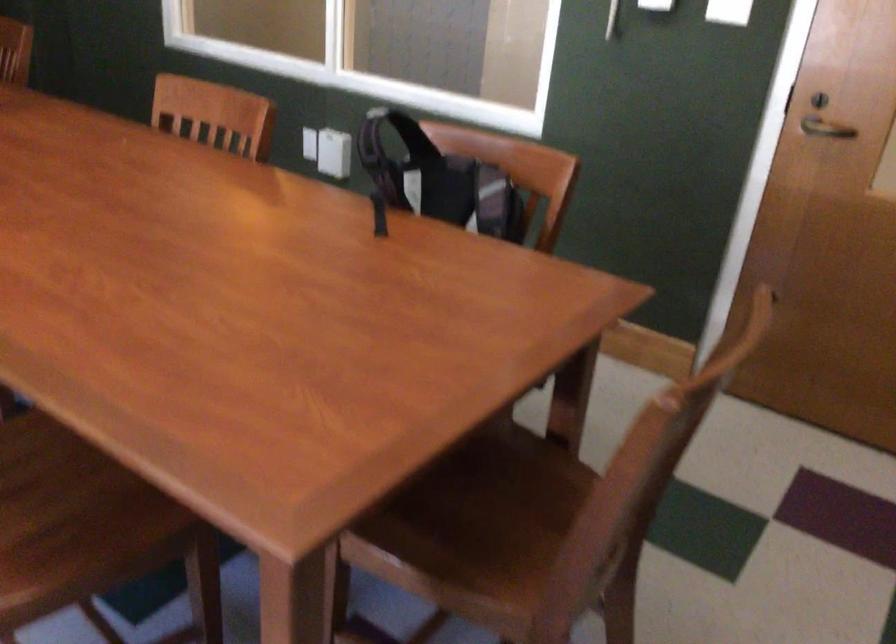
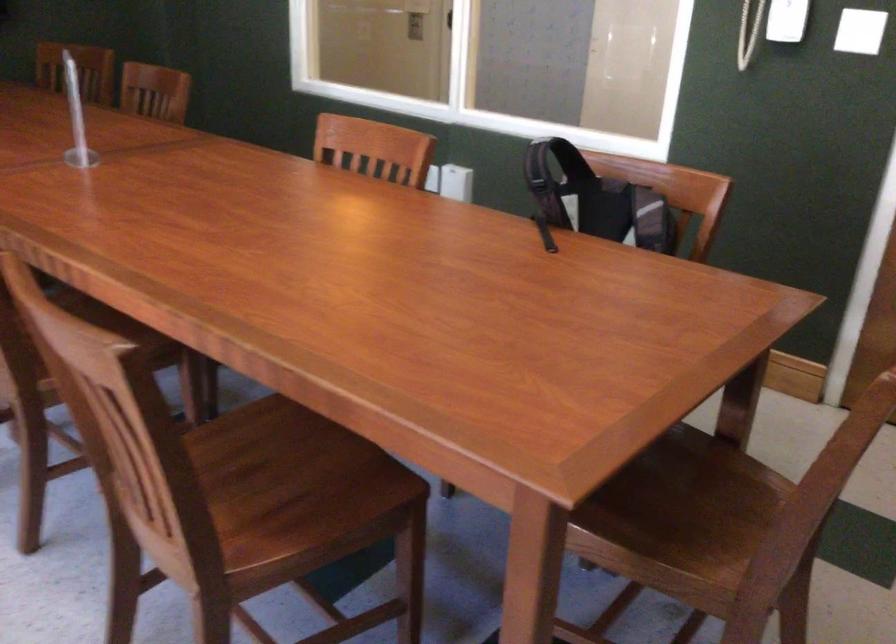
What movement of the cameraman would produce the second image?

The cameraman moved toward left, backward.